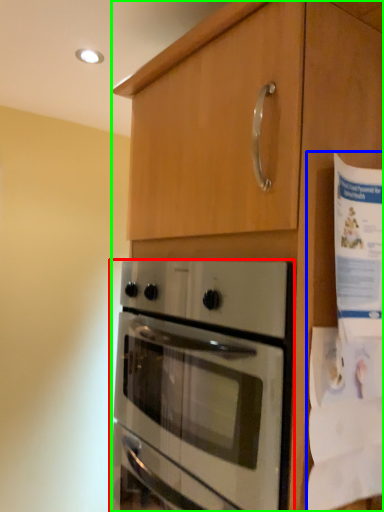
Question: Based on their relative distances, which object is farther from oven (highlighted by a red box)? Choose from paper (highlighted by a blue box) and cabinetry (highlighted by a green box).

Choices:
 (A) paper
 (B) cabinetry

Answer: (A)